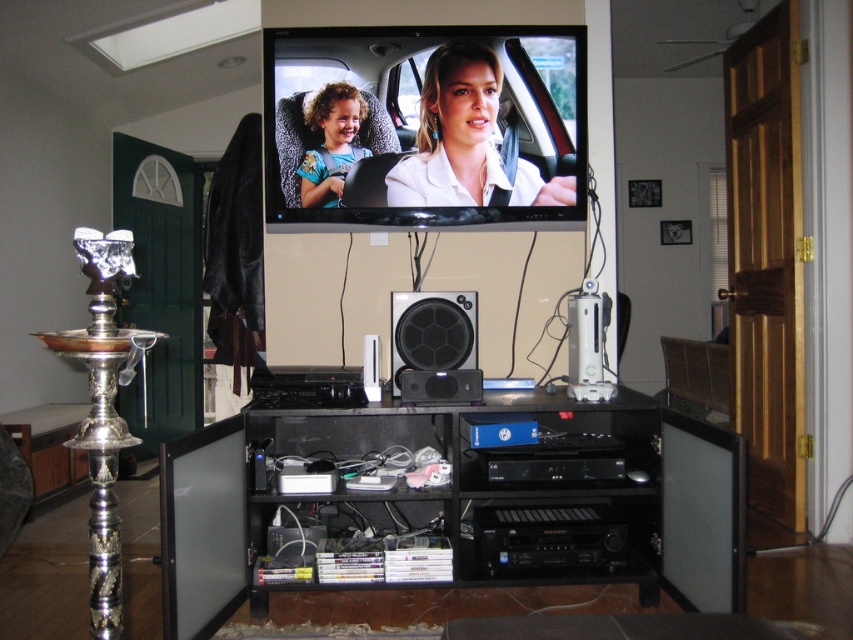
Question: Which point appears closest to the camera in this image?

Choices:
 (A) (492, 77)
 (B) (421, 332)
 (C) (648, 477)
 (D) (550, 618)

Answer: (D)

Question: Which point is closer to the camera taking this photo?

Choices:
 (A) (469, 196)
 (B) (218, 602)
 (C) (543, 134)
 (D) (440, 406)

Answer: (B)

Question: Does black plastic entertainment center at center come behind matte black car at upper center?

Choices:
 (A) yes
 (B) no

Answer: (B)

Question: Which point is closer to the camera taking this photo?

Choices:
 (A) (703, 621)
 (B) (323, 102)

Answer: (A)

Question: Does black plastic flat at lower center appear under curly-haired child at center?

Choices:
 (A) no
 (B) yes

Answer: (B)

Question: Is black plastic flat at lower center positioned at the back of black matte speaker at center?

Choices:
 (A) yes
 (B) no

Answer: (B)